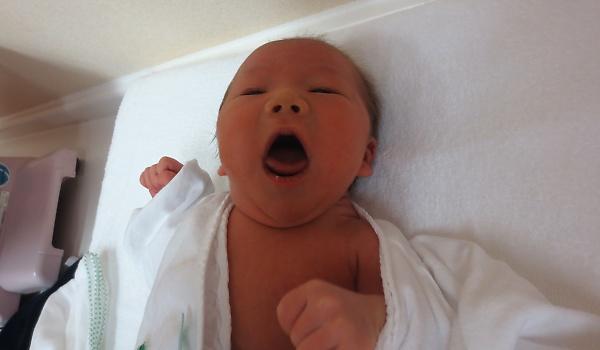
This screenshot has height=350, width=600. Find the location of `white blanket`. white blanket is located at coordinates (163, 223), (163, 322), (432, 269), (432, 330), (490, 304).